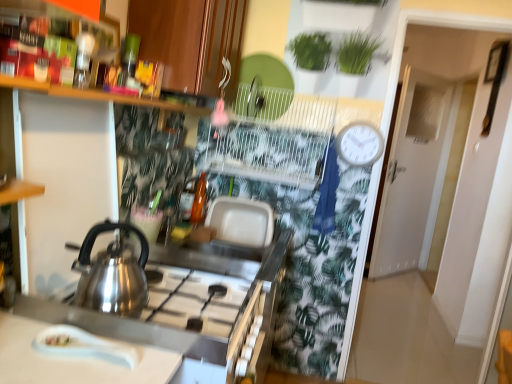
What do you see at coordinates (199, 201) in the screenshot? I see `translucent glass bottle at center, the second bottle in the front-to-back sequence` at bounding box center [199, 201].

The image size is (512, 384). Describe the element at coordinates (112, 273) in the screenshot. I see `satin silver kettle at stove front` at that location.

You are a GUI agent. You are given a task and a screenshot of the screen. Output one action in this format:
    pyautogui.click(x=<x>, y=<y>)
    Task: Click on the wooden cabinet at upper center
    The width and height of the screenshot is (512, 384).
    Given the screenshot: What is the action you would take?
    pyautogui.click(x=189, y=39)

Measure the distance between point (201, 4) and camera.

The depth of point (201, 4) is 1.53 meters.

Describe the element at coordinates (413, 171) in the screenshot. Image resolution: width=512 pixels, height=384 pixels. I see `white matte door at upper right` at that location.

This screenshot has height=384, width=512. Describe the element at coordinates (96, 95) in the screenshot. I see `wooden shelf at upper left` at that location.

The width and height of the screenshot is (512, 384). I want to click on translucent glass bottle at center, the second bottle in the front-to-back sequence, so click(199, 201).

Is wooden shelf at upper left far away from stainless steel counter at lower left?

No, wooden shelf at upper left is not far from stainless steel counter at lower left.

In the scene shown: Is stainless steel counter at lower left completely or partially inside wooden shelf at upper left?

Definitely not — stainless steel counter at lower left is not inside wooden shelf at upper left.

How different are the orientations of wooden shelf at upper left and stainless steel counter at lower left in degrees?

There is a 0.178-degree angle between the facing directions of wooden shelf at upper left and stainless steel counter at lower left.

Considering the positions of objects wooden shelf at upper left and stainless steel counter at lower left in the image provided, who is more to the left, wooden shelf at upper left or stainless steel counter at lower left?

wooden shelf at upper left.

How many degrees apart are the facing directions of white glossy spoon at lower left and white matte door at upper right?

137 degrees.

Consider the image. Which of these two, white glossy spoon at lower left or white matte door at upper right, stands taller?

Standing taller between the two is white matte door at upper right.

Considering the sizes of objects white glossy spoon at lower left and white matte door at upper right in the image provided, who is bigger, white glossy spoon at lower left or white matte door at upper right?

Bigger between the two is white matte door at upper right.

In the scene shown: Which is correct: white glossy spoon at lower left is inside white matte door at upper right, or outside of it?

white glossy spoon at lower left is located beyond the bounds of white matte door at upper right.

Does white glossy spoon at lower left turn towards translucent glass bottle at center, the second bottle in the front-to-back sequence?

No, white glossy spoon at lower left is not aimed at translucent glass bottle at center, the second bottle in the front-to-back sequence.

In the scene shown: Which object is positioned more to the right, white glossy spoon at lower left or translucent glass bottle at center, the second bottle in the front-to-back sequence?

translucent glass bottle at center, the second bottle in the front-to-back sequence.

Is translucent glass bottle at center, the first bottle positioned from the back, a part of white glossy spoon at lower left?

No, translucent glass bottle at center, the first bottle positioned from the back, is not surrounded by white glossy spoon at lower left.

In terms of height, does wooden cabinet at upper center look taller or shorter compared to wooden shelf at upper left?

Clearly, wooden cabinet at upper center is taller compared to wooden shelf at upper left.

Locate an element on the screen. This screenshot has width=512, height=384. cabinetry above the wooden shelf at upper left (from a real-world perspective) is located at coordinates (189, 39).

Which is further, (227, 18) or (0, 78)?

The point (227, 18) is farther from the camera.

Based on the photo, considering the sizes of objects wooden cabinet at upper center and wooden shelf at upper left in the image provided, who is bigger, wooden cabinet at upper center or wooden shelf at upper left?

wooden cabinet at upper center.

In terms of width, does white glossy spoon at lower left look wider or thinner when compared to stainless steel counter at lower left?

Considering their sizes, white glossy spoon at lower left looks slimmer than stainless steel counter at lower left.

Which is closer, [33,337] or [251,319]?

Point [33,337]

Which of these two, white glossy spoon at lower left or stainless steel counter at lower left, stands taller?

With more height is stainless steel counter at lower left.

Does white glossy spoon at lower left have a larger size compared to stainless steel counter at lower left?

Incorrect, white glossy spoon at lower left is not larger than stainless steel counter at lower left.

Which of these two, translucent glass bottle at center, the 1th bottle in the front-to-back sequence, or wooden shelf at upper left, is thinner?

With smaller width is translucent glass bottle at center, the 1th bottle in the front-to-back sequence.

Does translucent glass bottle at center, the 1th bottle in the front-to-back sequence, turn towards wooden shelf at upper left?

No, translucent glass bottle at center, the 1th bottle in the front-to-back sequence, is not oriented towards wooden shelf at upper left.

Consider the image. Considering the relative sizes of translucent glass bottle at center, marked as the second bottle in a back-to-front arrangement, and wooden shelf at upper left in the image provided, is translucent glass bottle at center, marked as the second bottle in a back-to-front arrangement, shorter than wooden shelf at upper left?

No.

Which point is more forward, [194,189] or [70,90]?

The point [70,90] is in front.

From the picture: Would you say white matte door at upper right is to the left or to the right of wooden cabinet at upper center in the picture?

Based on their positions, white matte door at upper right is located to the right of wooden cabinet at upper center.

Consider the image. Is wooden cabinet at upper center at the back of white matte door at upper right?

No, white matte door at upper right's orientation is not away from wooden cabinet at upper center.

Looking at the image, does white matte door at upper right seem bigger or smaller compared to wooden cabinet at upper center?

white matte door at upper right is bigger than wooden cabinet at upper center.

Is white matte door at upper right next to wooden cabinet at upper center and touching it?

They are not placed beside each other.

Where is `shelf that appears above the stainless steel counter at lower left (from the image's perspective)`? The image size is (512, 384). shelf that appears above the stainless steel counter at lower left (from the image's perspective) is located at coordinates (96, 95).

Locate an element on the screen. This screenshot has width=512, height=384. countertop below the white matte door at upper right (from a real-world perspective) is located at coordinates (75, 358).

Considering their positions, is translucent glass bottle at center, the second bottle in the front-to-back sequence, positioned further to white glossy spoon at lower left than stainless steel counter at lower left?

translucent glass bottle at center, the second bottle in the front-to-back sequence.

Estimate the real-world distances between objects in this image. Which object is further from wooden shelf at upper left, white plastic clock at upper right or translucent glass bottle at center, marked as the second bottle in a back-to-front arrangement?

white plastic clock at upper right.

Based on their spatial positions, is stainless steel counter at lower left or wooden shelf at upper left further from white matte door at upper right?

wooden shelf at upper left is positioned further to the anchor white matte door at upper right.

Estimate the real-world distances between objects in this image. Which object is further from wooden shelf at upper left, satin silver kettle at stove front or white plastic clock at upper right?

white plastic clock at upper right.

Looking at the image, which one is located closer to translucent glass bottle at center, marked as the second bottle in a back-to-front arrangement, wooden cabinet at upper center or translucent glass bottle at center, the second bottle in the front-to-back sequence?

Among the two, translucent glass bottle at center, the second bottle in the front-to-back sequence, is located nearer to translucent glass bottle at center, marked as the second bottle in a back-to-front arrangement.

Based on their spatial positions, is wooden cabinet at upper center or white plastic clock at upper right further from white matte door at upper right?

The object further to white matte door at upper right is wooden cabinet at upper center.

Looking at the image, which one is located closer to white plastic clock at upper right, satin silver kettle at stove front or translucent glass bottle at center, marked as the second bottle in a back-to-front arrangement?

translucent glass bottle at center, marked as the second bottle in a back-to-front arrangement, is positioned closer to the anchor white plastic clock at upper right.

When comparing their distances from stainless steel counter at lower left, does wooden cabinet at upper center or satin silver kettle at stove front seem further?

Among the two, wooden cabinet at upper center is located further to stainless steel counter at lower left.

Where is `cabinetry situated between translucent glass bottle at center, marked as the second bottle in a back-to-front arrangement, and white plastic clock at upper right from left to right`? The height and width of the screenshot is (384, 512). cabinetry situated between translucent glass bottle at center, marked as the second bottle in a back-to-front arrangement, and white plastic clock at upper right from left to right is located at coordinates (189, 39).

You are a GUI agent. You are given a task and a screenshot of the screen. Output one action in this format:
    pyautogui.click(x=<x>, y=<y>)
    Task: Click on the countertop between wooden cabinet at upper center and stainless steel counter at lower left vertically
    Image resolution: width=512 pixels, height=384 pixels.
    Given the screenshot: What is the action you would take?
    pyautogui.click(x=75, y=358)

This screenshot has width=512, height=384. I want to click on shelf between wooden cabinet at upper center and satin silver kettle at stove front in the vertical direction, so click(x=96, y=95).

Where is `bottle positioned between stainless steel counter at lower left and white plastic clock at upper right from near to far`? Image resolution: width=512 pixels, height=384 pixels. bottle positioned between stainless steel counter at lower left and white plastic clock at upper right from near to far is located at coordinates (187, 199).